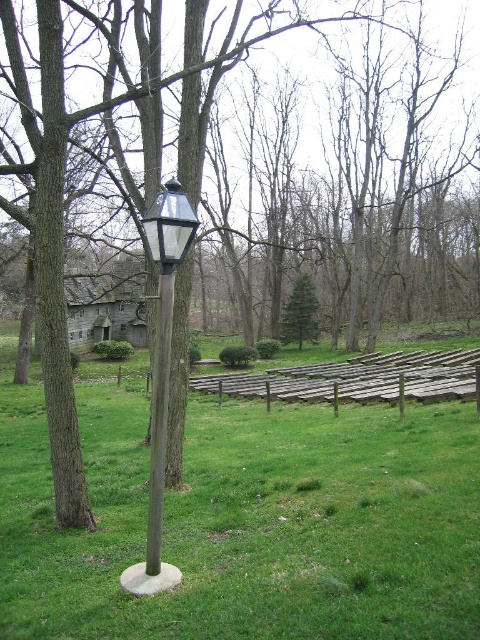
You are a park maintenance worker who needs to replace the brown wooden fence at center and the smooth wooden post at center. According to the scene, which object is located to the right of the other?

The brown wooden fence at center is positioned on the right side of smooth wooden post at center, so the brown wooden fence at center is to the right of the smooth wooden post at center.

From the picture: You are standing in the park and see the smooth wooden post at center and the green matte evergreen tree at center. Which object is positioned further to the left?

The smooth wooden post at center is positioned further to the left compared to the green matte evergreen tree at center, as it is located to the left of it according to the description.